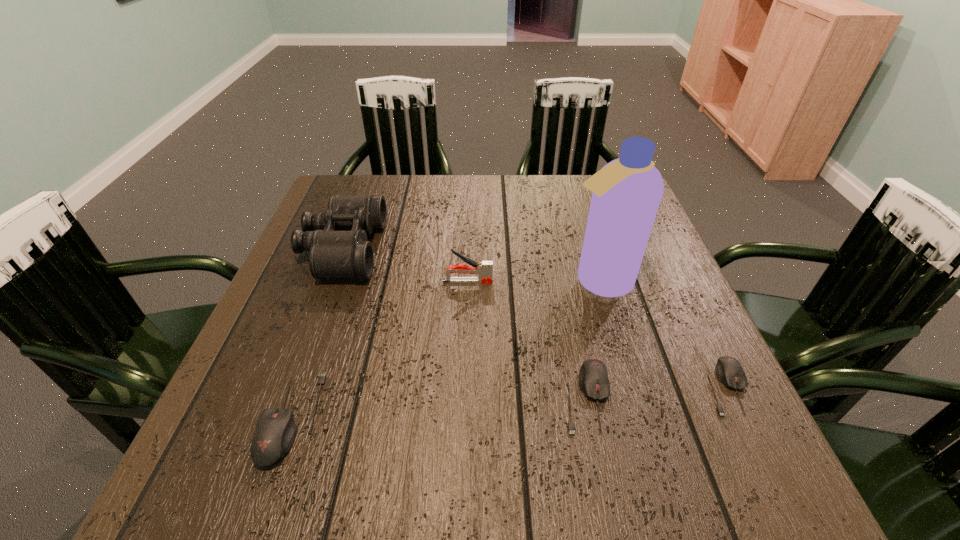
Select which mouse appears as the closest to the second tallest mouse. Please provide its 2D coordinates. Your answer should be formatted as a tuple, i.e. [(x, y)], where the tuple contains the x and y coordinates of a point satisfying the conditions above.

[(729, 371)]

Where is `vacant space that satisfies the following two spatial constraints: 1. on the handle side of the third object from left to right; 2. on the right side of the shampoo`? This screenshot has height=540, width=960. vacant space that satisfies the following two spatial constraints: 1. on the handle side of the third object from left to right; 2. on the right side of the shampoo is located at coordinates point(468,281).

Where is `free point that satisfies the following two spatial constraints: 1. on the front side of the tallest object; 2. on the right side of the shortest object`? Image resolution: width=960 pixels, height=540 pixels. free point that satisfies the following two spatial constraints: 1. on the front side of the tallest object; 2. on the right side of the shortest object is located at coordinates (x=630, y=387).

In order to click on blank space that satisfies the following two spatial constraints: 1. on the back side of the second shortest object; 2. at the eyepieces of the binoculars in this screenshot , I will do pos(556,248).

This screenshot has width=960, height=540. Find the location of `free location that satisfies the following two spatial constraints: 1. on the back side of the fifth tallest object; 2. at the eyepieces of the binoculars`. free location that satisfies the following two spatial constraints: 1. on the back side of the fifth tallest object; 2. at the eyepieces of the binoculars is located at coordinates (556, 248).

The image size is (960, 540). In order to click on vacant position in the image that satisfies the following two spatial constraints: 1. at the eyepieces of the shampoo; 2. on the left side of the binoculars in this screenshot , I will do (x=330, y=281).

You are a GUI agent. You are given a task and a screenshot of the screen. Output one action in this format:
    pyautogui.click(x=<x>, y=<y>)
    Task: Click on the vacant space that satisfies the following two spatial constraints: 1. on the back side of the leftmost mouse; 2. at the eyepieces of the binoculars
    
    Given the screenshot: What is the action you would take?
    pyautogui.click(x=350, y=248)

Locate an element on the screen. The height and width of the screenshot is (540, 960). free space in the image that satisfies the following two spatial constraints: 1. at the eyepieces of the binoculars; 2. on the back side of the leftmost mouse is located at coordinates (280, 418).